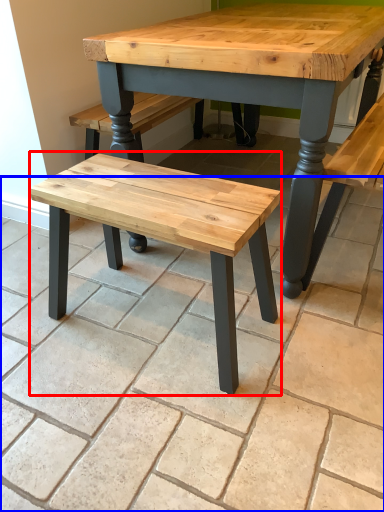
Question: Which point is closer to the camera, stool (highlighted by a red box) or tile (highlighted by a blue box)?

Choices:
 (A) stool
 (B) tile

Answer: (B)